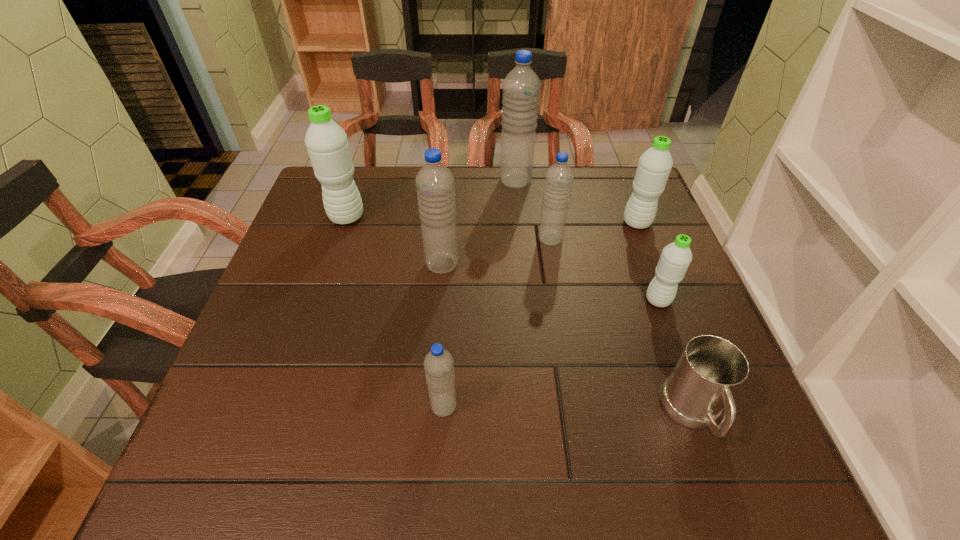
You are a GUI agent. You are given a task and a screenshot of the screen. Output one action in this format:
    pyautogui.click(x=<x>, y=<y>)
    Task: Click on the free point located on the back of the smallest blue water bottle
    
    Given the screenshot: What is the action you would take?
    pyautogui.click(x=450, y=300)

Where is `object present at the near edge`? This screenshot has height=540, width=960. object present at the near edge is located at coordinates (710, 370).

This screenshot has height=540, width=960. Find the location of `object located in the left edge section of the desktop`. object located in the left edge section of the desktop is located at coordinates (327, 144).

The image size is (960, 540). In order to click on mug that is at the right edge in this screenshot , I will do `click(710, 370)`.

The width and height of the screenshot is (960, 540). I want to click on object located at the far left corner, so click(327, 144).

Where is `object situated at the far right corner`? Image resolution: width=960 pixels, height=540 pixels. object situated at the far right corner is located at coordinates (654, 166).

The image size is (960, 540). Find the location of `object at the near right corner`. object at the near right corner is located at coordinates (710, 370).

In the image, there is a desktop. Identify the location of vacant space at the far edge. The image size is (960, 540). (539, 186).

I want to click on free space at the near edge of the desktop, so click(436, 460).

What are the coordinates of `vacant area at the left edge of the desktop` in the screenshot? It's located at (326, 251).